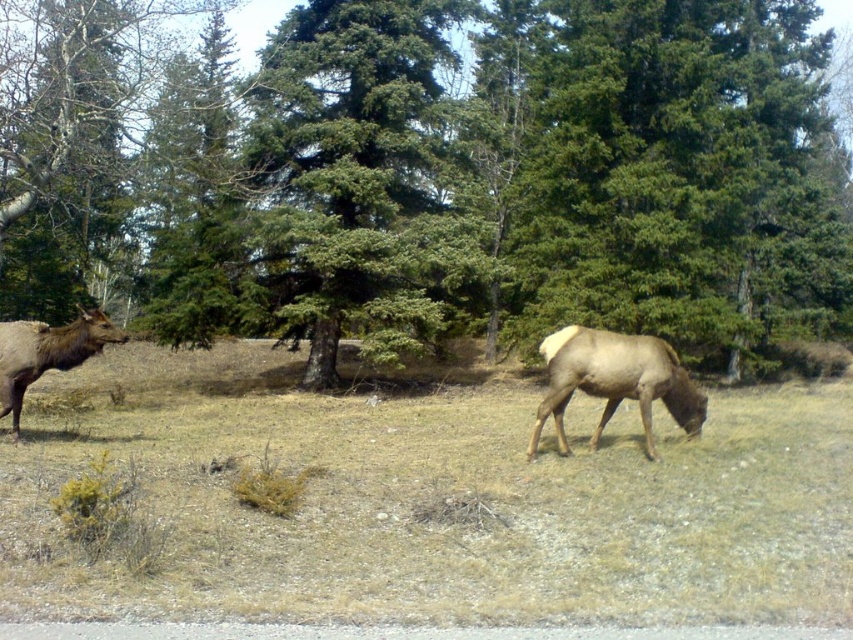
You are an archer standing at the edge of the grassy area where the two elk are grazing. You want to aim at the green leafy tree at center to test your arrow. Where should you aim your arrow to hit the tree?

You should aim at the point with coordinates (439, 176) to hit the green leafy tree at center.